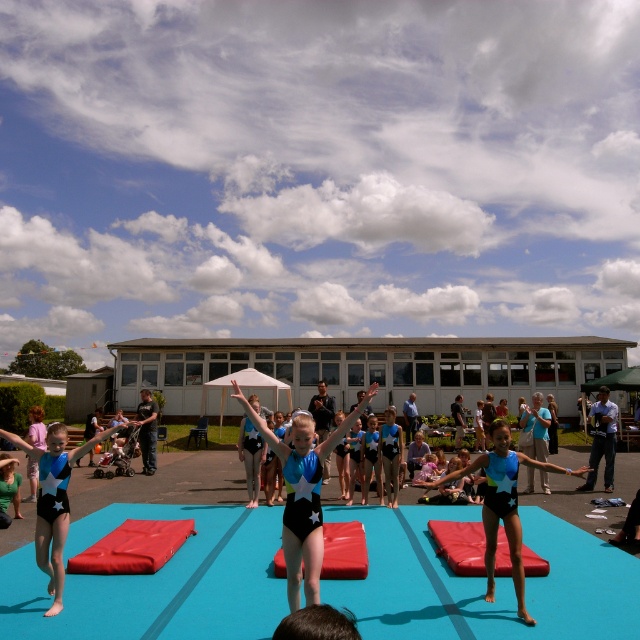
You are a photographer at the event and want to capture a photo that includes both the blue spandex leotard at center and the black leotard at left. Based on their positions, which gymnast should you focus on first to ensure both are in frame?

The blue spandex leotard at center is to the right of the black leotard at left. To include both in the frame, focus on the black leotard at left first since it is positioned further left, allowing the photographer to adjust the camera to include the rightward positioned blue spandex leotard at center.

Consider the image. You are a photographer standing at the origin point of the coordinate system. You want to capture a photo of the shiny blue leotard at center. What are the coordinates where you should aim your camera?

The coordinates to aim the camera are at point [301,493] to capture the shiny blue leotard at center.

You are a photographer trying to capture a clear shot of both the shiny blue leotard at center and the blue spandex leotard at center. However, you notice that one is blocking the view of the other. Which leotard is obstructing the other?

The shiny blue leotard at center is in front of the blue spandex leotard at center, so it is obstructing the view of the blue spandex leotard at center.